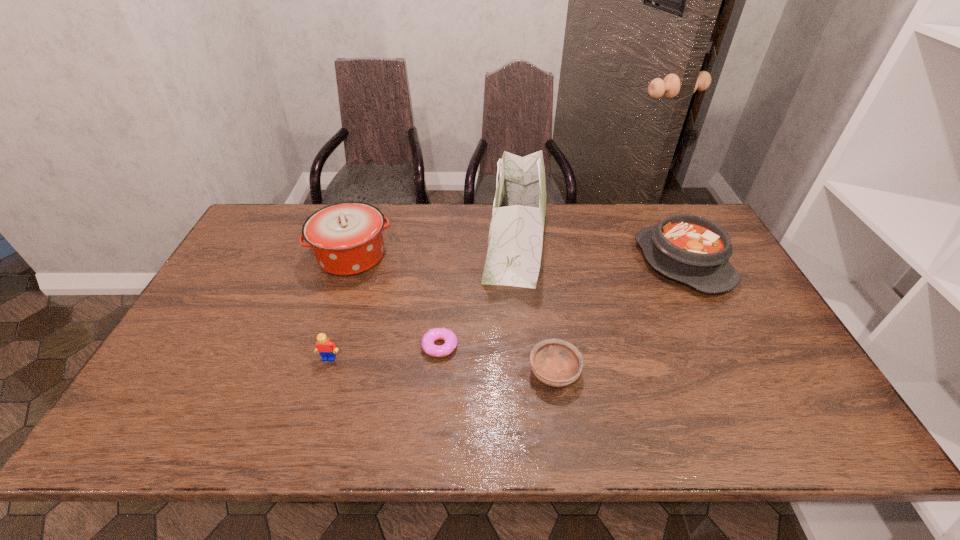
In the image, there is a desktop. In order to click on vacant space at the right edge in this screenshot , I will do `click(730, 319)`.

This screenshot has width=960, height=540. What are the coordinates of `vacant space at the far left corner` in the screenshot? It's located at (262, 211).

Find the location of a particular element. This screenshot has width=960, height=540. free space between the fourth object from right to left and the left casserole is located at coordinates (396, 301).

Identify the location of vacant point located between the shortest object and the tallest object. (478, 295).

Locate an element on the screen. free spot between the rightmost object and the Lego is located at coordinates [x=506, y=310].

Locate an element on the screen. The image size is (960, 540). blank region between the grocery bag and the Lego is located at coordinates (422, 301).

Image resolution: width=960 pixels, height=540 pixels. I want to click on empty space that is in between the third shortest object and the grocery bag, so click(422, 301).

What are the coordinates of `free space between the tallest object and the Lego` in the screenshot? It's located at pos(422,301).

Where is `free space between the left casserole and the bowl`? Image resolution: width=960 pixels, height=540 pixels. free space between the left casserole and the bowl is located at coordinates (453, 314).

This screenshot has width=960, height=540. What are the coordinates of `free space between the Lego and the taller casserole` in the screenshot? It's located at (341, 307).